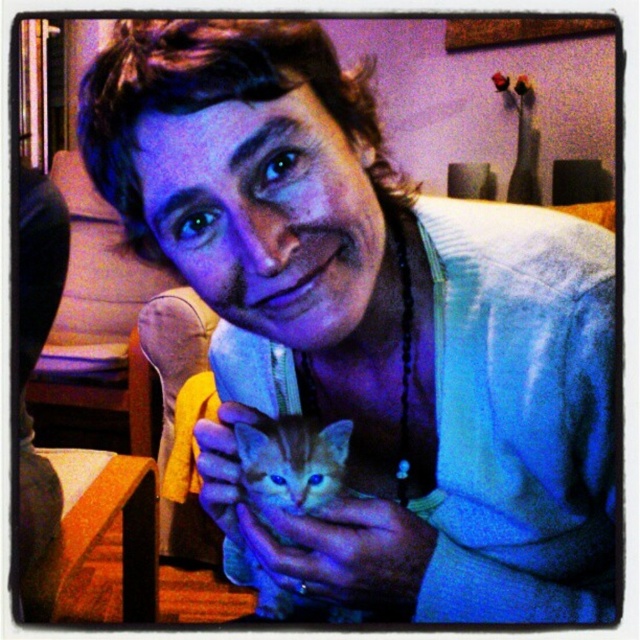
Question: Is matte skin hand at lower center above fuzzy orange cat at center?

Choices:
 (A) no
 (B) yes

Answer: (B)

Question: Which point is farther to the camera?

Choices:
 (A) (364, 508)
 (B) (285, 600)

Answer: (B)

Question: Is matte skin hand at lower center further to camera compared to fuzzy orange cat at center?

Choices:
 (A) yes
 (B) no

Answer: (B)

Question: Which point is closer to the camera?

Choices:
 (A) fuzzy orange cat at center
 (B) matte skin hand at lower center

Answer: (B)

Question: Is the position of matte skin hand at lower center more distant than that of fuzzy orange cat at center?

Choices:
 (A) no
 (B) yes

Answer: (A)